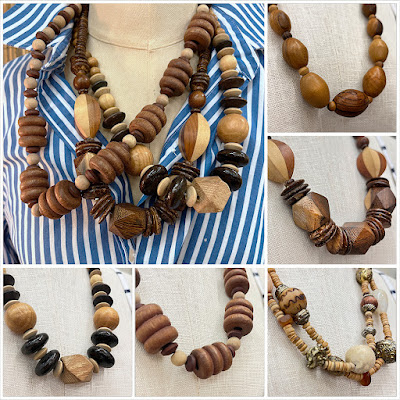
In order to click on picture in this screenshot , I will do `click(71, 336)`, `click(193, 330)`, `click(331, 330)`, `click(330, 192)`, `click(352, 68)`, `click(134, 107)`.